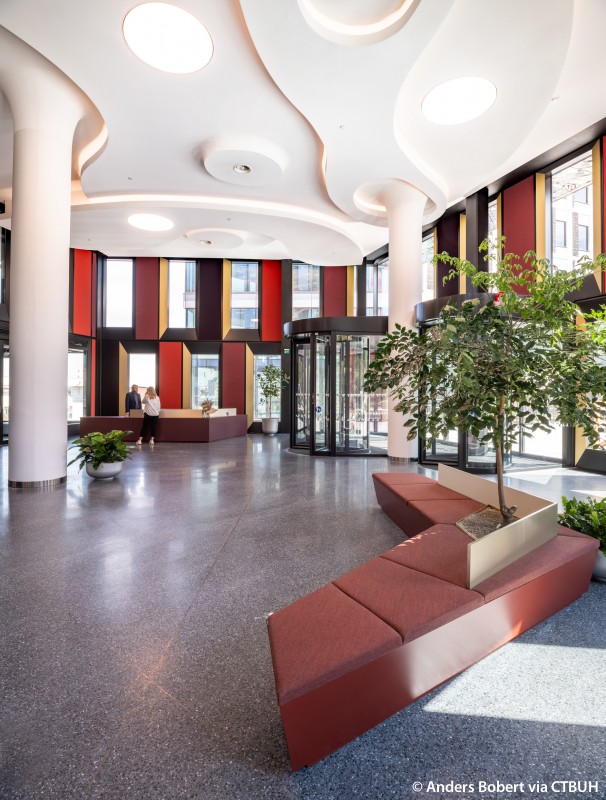
You are a GUI agent. You are given a task and a screenshot of the screen. Output one action in this format:
    pyautogui.click(x=<x>, y=<y>)
    Task: Click on the plant
    This screenshot has height=800, width=606.
    Given the screenshot: What is the action you would take?
    pyautogui.click(x=108, y=442), pyautogui.click(x=597, y=518)